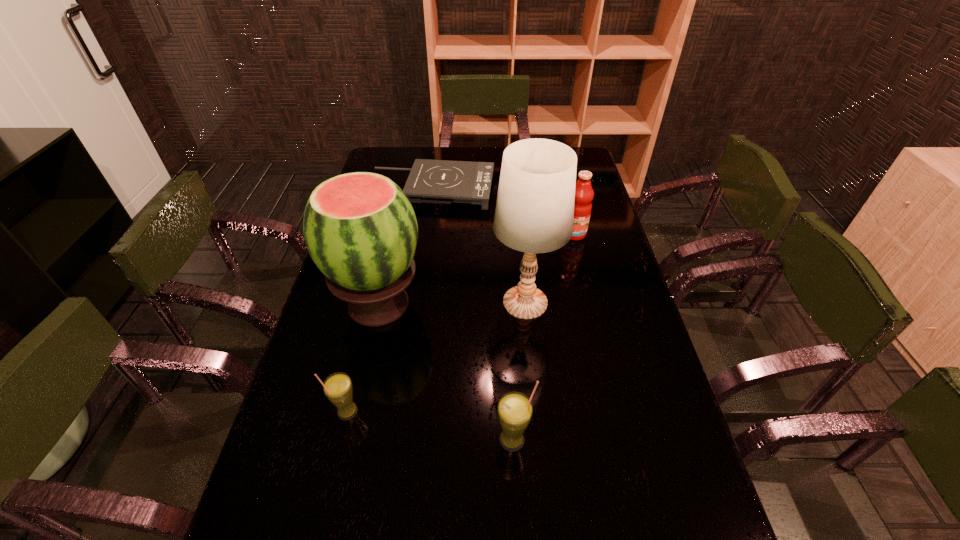
This screenshot has height=540, width=960. I want to click on the left straw for drinking, so click(338, 388).

Identify the location of the shorter straw for drinking. (338, 388).

Identify the location of the right straw for drinking. (514, 410).

At what (x,y) coordinates should I click in order to perform the action: click on the taller straw for drinking. Please return your answer as a coordinate pair (x, y). Looking at the image, I should click on (514, 410).

Identify the location of the shortest object. (430, 181).

The image size is (960, 540). What are the coordinates of `the farthest object` in the screenshot? It's located at (430, 181).

Where is `fruit juice`? The image size is (960, 540). fruit juice is located at coordinates (584, 194).

The image size is (960, 540). Identify the location of the fifth nearest object. (584, 194).

In order to click on lamp in this screenshot , I will do `click(534, 213)`.

Where is `watermelon`? The height and width of the screenshot is (540, 960). watermelon is located at coordinates (360, 229).